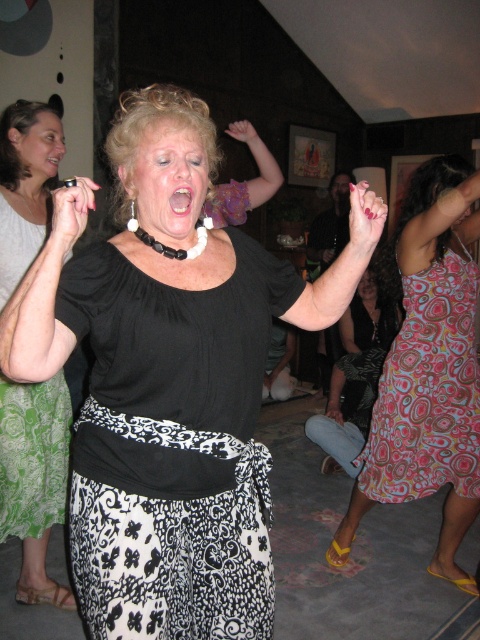
Who is higher up, black matte skirt at center or black satin dress at center?

black matte skirt at center

Locate an element on the screen. This screenshot has height=640, width=480. black matte skirt at center is located at coordinates (172, 448).

Find the location of a particular element. The image size is (480, 640). black matte skirt at center is located at coordinates (172, 448).

This screenshot has height=640, width=480. What do you see at coordinates (169, 380) in the screenshot?
I see `black matte blouse at center` at bounding box center [169, 380].

Who is more distant from viewer, (261,620) or (406,476)?

The point (406,476) is more distant.

What are the coordinates of `black matte blouse at center` in the screenshot? It's located at (169, 380).

Does black matte dress at center have a lesser height compared to pink glossy lips at center?

No, black matte dress at center is not shorter than pink glossy lips at center.

Which is more to the right, black matte dress at center or pink glossy lips at center?

pink glossy lips at center is more to the right.

You are a GUI agent. You are given a task and a screenshot of the screen. Output one action in this format:
    pyautogui.click(x=<x>, y=<y>)
    Task: Click on the black matte dress at center
    Image resolution: width=480 pixels, height=640 pixels.
    Given the screenshot: What is the action you would take?
    pyautogui.click(x=35, y=477)